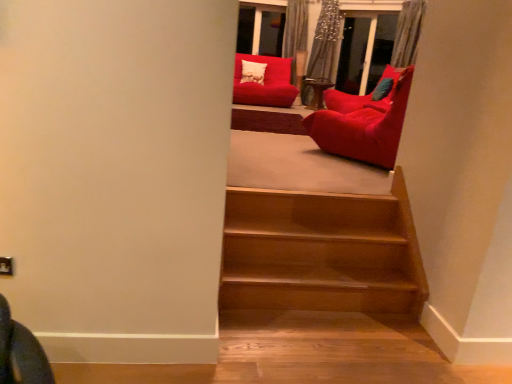
What do you see at coordinates (265, 83) in the screenshot?
I see `matte red beanbag at upper center, which is the 2th chair in bottom-to-top order` at bounding box center [265, 83].

I want to click on matte red beanbag at upper center, the first chair when ordered from top to bottom, so click(x=265, y=83).

This screenshot has width=512, height=384. I want to click on velvet red bean bag at upper right, arranged as the second chair when viewed from the top, so pos(362,122).

The height and width of the screenshot is (384, 512). What do you see at coordinates (362, 122) in the screenshot?
I see `velvet red bean bag at upper right, which is counted as the second chair, starting from the back` at bounding box center [362, 122].

You are a GUI agent. You are given a task and a screenshot of the screen. Output one action in this format:
    pyautogui.click(x=<x>, y=<y>)
    Task: Click on the matte red beanbag at upper center, which is the 2th chair in bottom-to-top order
    Image resolution: width=512 pixels, height=384 pixels.
    Given the screenshot: What is the action you would take?
    pyautogui.click(x=265, y=83)

Which is more to the left, matte red beanbag at upper center, the 2th chair viewed from the front, or velvet red bean bag at upper right, positioned as the 1th chair in bottom-to-top order?

matte red beanbag at upper center, the 2th chair viewed from the front, is more to the left.

Looking at this image, considering the positions of objects matte red beanbag at upper center, the first chair when ordered from top to bottom, and velvet red bean bag at upper right, positioned as the 1th chair in bottom-to-top order, in the image provided, who is in front, matte red beanbag at upper center, the first chair when ordered from top to bottom, or velvet red bean bag at upper right, positioned as the 1th chair in bottom-to-top order,?

velvet red bean bag at upper right, positioned as the 1th chair in bottom-to-top order, is more forward.

Which is in front, point (256, 86) or point (390, 92)?

Point (390, 92)

From the image's perspective, does matte red beanbag at upper center, which is the 2th chair in bottom-to-top order, appear higher than velvet red bean bag at upper right, which is the 1th chair from front to back?

Indeed, from the image's perspective, matte red beanbag at upper center, which is the 2th chair in bottom-to-top order, is shown above velvet red bean bag at upper right, which is the 1th chair from front to back.

From a real-world perspective, between matte red beanbag at upper center, which is the 2th chair in bottom-to-top order, and velvet red bean bag at upper right, which is counted as the second chair, starting from the back, who is vertically lower?

From a 3D spatial view, matte red beanbag at upper center, which is the 2th chair in bottom-to-top order, is below.

Considering the relative sizes of matte red beanbag at upper center, the first chair when ordered from top to bottom, and velvet red bean bag at upper right, which appears as the 2th chair when viewed from the left, in the image provided, is matte red beanbag at upper center, the first chair when ordered from top to bottom, wider than velvet red bean bag at upper right, which appears as the 2th chair when viewed from the left,?

Yes, matte red beanbag at upper center, the first chair when ordered from top to bottom, is wider than velvet red bean bag at upper right, which appears as the 2th chair when viewed from the left.

Which of these two, matte red beanbag at upper center, the 1th chair when ordered from back to front, or velvet red bean bag at upper right, positioned as the 1th chair in bottom-to-top order, stands taller?

velvet red bean bag at upper right, positioned as the 1th chair in bottom-to-top order.

Which of these two, matte red beanbag at upper center, the 2th chair viewed from the front, or velvet red bean bag at upper right, which is counted as the second chair, starting from the back, is bigger?

matte red beanbag at upper center, the 2th chair viewed from the front, is bigger.

Is matte red beanbag at upper center, marked as the 1th chair in a left-to-right arrangement, located outside velvet red bean bag at upper right, which appears as the 2th chair when viewed from the left?

matte red beanbag at upper center, marked as the 1th chair in a left-to-right arrangement, is positioned outside velvet red bean bag at upper right, which appears as the 2th chair when viewed from the left.

Is matte red beanbag at upper center, which is the 2th chair in bottom-to-top order, far away from velvet red bean bag at upper right, positioned as the 1th chair in bottom-to-top order?

That's right, there is a large distance between matte red beanbag at upper center, which is the 2th chair in bottom-to-top order, and velvet red bean bag at upper right, positioned as the 1th chair in bottom-to-top order.

Is matte red beanbag at upper center, the 2th chair viewed from the right, facing towards velvet red bean bag at upper right, which is the 1th chair from front to back?

Yes, matte red beanbag at upper center, the 2th chair viewed from the right, is oriented towards velvet red bean bag at upper right, which is the 1th chair from front to back.

How different are the orientations of matte red beanbag at upper center, the 2th chair viewed from the front, and velvet red bean bag at upper right, placed as the first chair when sorted from right to left, in degrees?

The angle between the facing direction of matte red beanbag at upper center, the 2th chair viewed from the front, and the facing direction of velvet red bean bag at upper right, placed as the first chair when sorted from right to left, is 146 degrees.

The width and height of the screenshot is (512, 384). What are the coordinates of `chair that is in front of the matte red beanbag at upper center, the 1th chair when ordered from back to front` in the screenshot? It's located at (362, 122).

Is velvet red bean bag at upper right, which appears as the 2th chair when viewed from the left, at the right side of matte red beanbag at upper center, the first chair when ordered from top to bottom?

Correct, you'll find velvet red bean bag at upper right, which appears as the 2th chair when viewed from the left, to the right of matte red beanbag at upper center, the first chair when ordered from top to bottom.

From the picture: Which object is further away from the camera taking this photo, velvet red bean bag at upper right, arranged as the second chair when viewed from the top, or matte red beanbag at upper center, marked as the 1th chair in a left-to-right arrangement?

Positioned behind is matte red beanbag at upper center, marked as the 1th chair in a left-to-right arrangement.

Considering the points (396, 127) and (285, 95), which point is in front, point (396, 127) or point (285, 95)?

Point (396, 127)

From the image's perspective, would you say velvet red bean bag at upper right, arranged as the second chair when viewed from the top, is shown under matte red beanbag at upper center, the first chair when ordered from top to bottom?

Correct, velvet red bean bag at upper right, arranged as the second chair when viewed from the top, appears lower than matte red beanbag at upper center, the first chair when ordered from top to bottom, in the image.

From a real-world perspective, which object rests below the other?

From a 3D spatial view, matte red beanbag at upper center, the first chair when ordered from top to bottom, is below.

From the picture: Does velvet red bean bag at upper right, which is the 1th chair from front to back, have a greater width compared to matte red beanbag at upper center, which is the 2th chair in bottom-to-top order?

No, velvet red bean bag at upper right, which is the 1th chair from front to back, is not wider than matte red beanbag at upper center, which is the 2th chair in bottom-to-top order.

Is velvet red bean bag at upper right, positioned as the 1th chair in bottom-to-top order, taller or shorter than matte red beanbag at upper center, marked as the 1th chair in a left-to-right arrangement?

velvet red bean bag at upper right, positioned as the 1th chair in bottom-to-top order, is taller than matte red beanbag at upper center, marked as the 1th chair in a left-to-right arrangement.

Looking at the image, does velvet red bean bag at upper right, placed as the first chair when sorted from right to left, seem bigger or smaller compared to matte red beanbag at upper center, marked as the 1th chair in a left-to-right arrangement?

velvet red bean bag at upper right, placed as the first chair when sorted from right to left, is smaller than matte red beanbag at upper center, marked as the 1th chair in a left-to-right arrangement.

Is velvet red bean bag at upper right, which appears as the 2th chair when viewed from the left, spatially inside matte red beanbag at upper center, the 1th chair when ordered from back to front, or outside of it?

velvet red bean bag at upper right, which appears as the 2th chair when viewed from the left, is located beyond the bounds of matte red beanbag at upper center, the 1th chair when ordered from back to front.

Is velvet red bean bag at upper right, which is counted as the second chair, starting from the back, next to matte red beanbag at upper center, marked as the 1th chair in a left-to-right arrangement?

velvet red bean bag at upper right, which is counted as the second chair, starting from the back, and matte red beanbag at upper center, marked as the 1th chair in a left-to-right arrangement, are not in contact.

Is velvet red bean bag at upper right, placed as the first chair when sorted from right to left, oriented towards matte red beanbag at upper center, the 2th chair viewed from the front?

Yes, velvet red bean bag at upper right, placed as the first chair when sorted from right to left, is turned towards matte red beanbag at upper center, the 2th chair viewed from the front.

This screenshot has width=512, height=384. Find the location of `chair that is on the left side of velvet red bean bag at upper right, which is the 1th chair from front to back`. chair that is on the left side of velvet red bean bag at upper right, which is the 1th chair from front to back is located at coordinates (265, 83).

This screenshot has height=384, width=512. What are the coordinates of `chair in front of the matte red beanbag at upper center, the 2th chair viewed from the right` in the screenshot? It's located at (362, 122).

You are a GUI agent. You are given a task and a screenshot of the screen. Output one action in this format:
    pyautogui.click(x=<x>, y=<y>)
    Task: Click on the chair on the left of velvet red bean bag at upper right, which is the 1th chair from front to back
    This screenshot has width=512, height=384.
    Given the screenshot: What is the action you would take?
    click(265, 83)